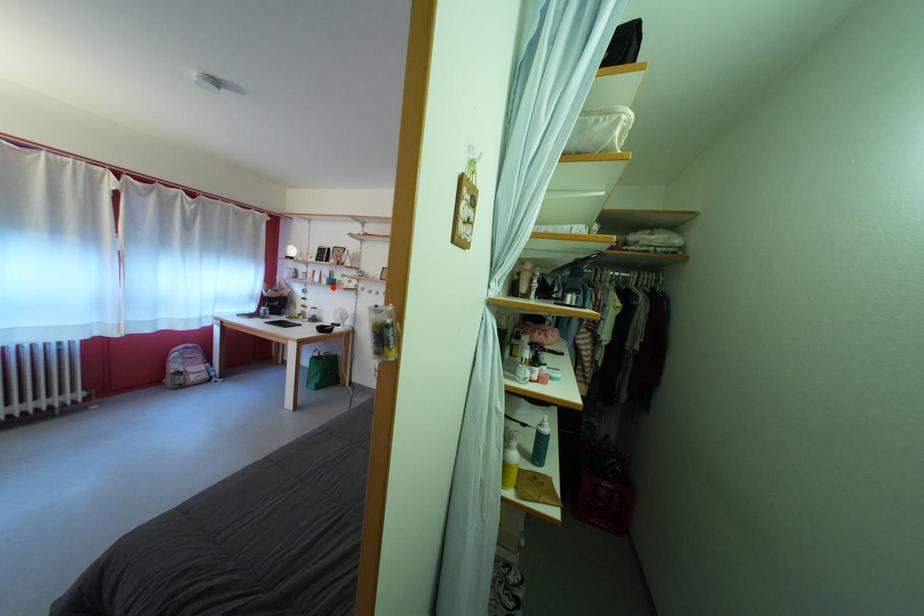
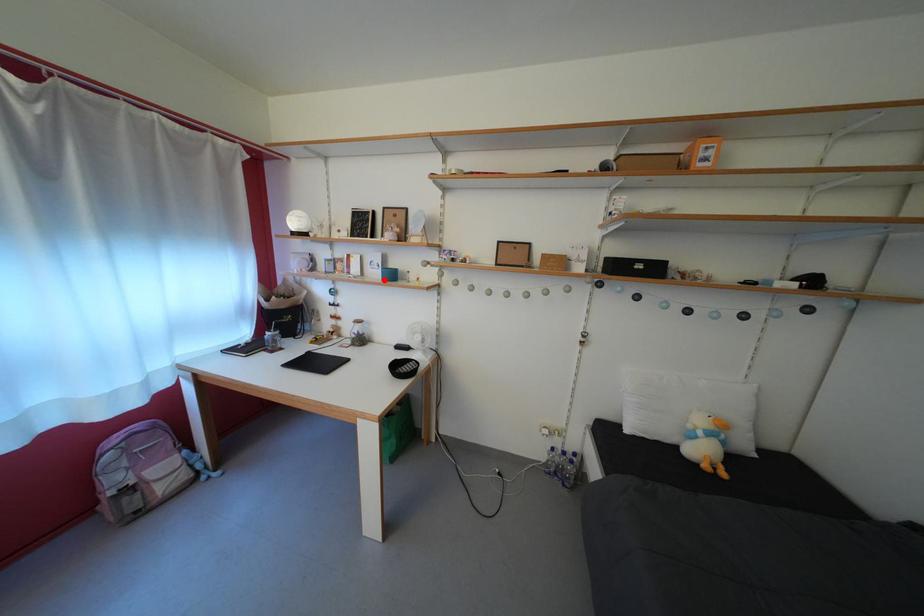
I am providing you with two images of the same scene from different viewpoints. A red point is marked on the first image and another point is marked on the second image. Are the points marked in image1 and image2 representing the same 3D position?

Yes